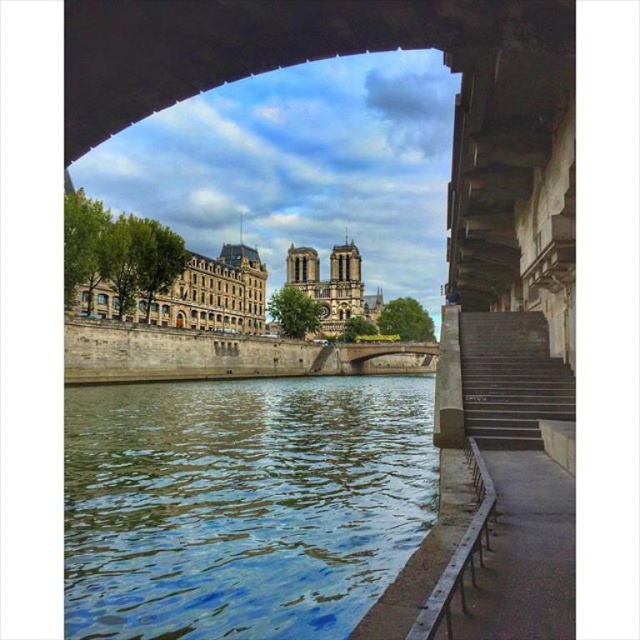
Does blue water at lower left appear on the right side of dark gray concrete stairs at right?

Incorrect, blue water at lower left is not on the right side of dark gray concrete stairs at right.

Which is below, blue water at lower left or dark gray concrete stairs at right?

blue water at lower left is lower down.

You are a GUI agent. You are given a task and a screenshot of the screen. Output one action in this format:
    pyautogui.click(x=<x>, y=<y>)
    Task: Click on the blue water at lower left
    The image size is (640, 640).
    Given the screenshot: What is the action you would take?
    pyautogui.click(x=241, y=504)

Who is lower down, blue water at lower left or metallic gray rail at lower right?

Positioned lower is metallic gray rail at lower right.

Can you confirm if blue water at lower left is taller than metallic gray rail at lower right?

Yes.

The image size is (640, 640). What are the coordinates of `blue water at lower left` in the screenshot? It's located at (241, 504).

Which is below, dark gray concrete stairs at right or metallic gray rail at lower right?

Positioned lower is metallic gray rail at lower right.

Is dark gray concrete stairs at right in front of metallic gray rail at lower right?

No, dark gray concrete stairs at right is further to the viewer.

Is point (477, 365) in front of point (440, 616)?

No, (477, 365) is further to viewer.

The image size is (640, 640). Identify the location of dark gray concrete stairs at right. (509, 380).